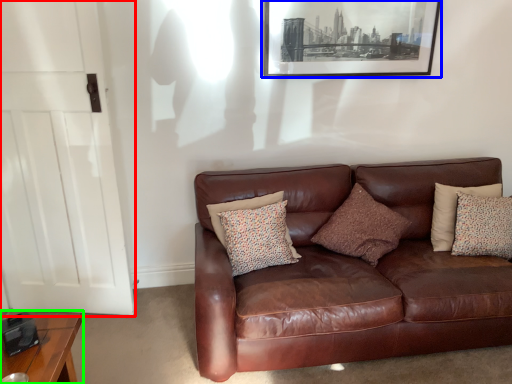
Question: Which is nearer to the door (highlighted by a red box)? picture frame (highlighted by a blue box) or table (highlighted by a green box).

Choices:
 (A) picture frame
 (B) table

Answer: (B)